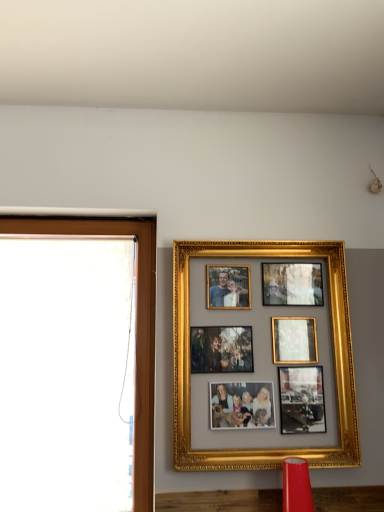
Question: From the image's perspective, is matte red lampshade at lower center on top of brown wooden window frame at left?

Choices:
 (A) yes
 (B) no

Answer: (B)

Question: Does matte red lampshade at lower center have a lesser width compared to brown wooden window frame at left?

Choices:
 (A) yes
 (B) no

Answer: (B)

Question: Is matte red lampshade at lower center facing towards brown wooden window frame at left?

Choices:
 (A) no
 (B) yes

Answer: (A)

Question: Is matte red lampshade at lower center wider than brown wooden window frame at left?

Choices:
 (A) no
 (B) yes

Answer: (B)

Question: Considering the relative sizes of matte red lampshade at lower center and brown wooden window frame at left in the image provided, is matte red lampshade at lower center smaller than brown wooden window frame at left?

Choices:
 (A) yes
 (B) no

Answer: (A)

Question: From the image's perspective, is gold/gilded photo frame at upper center located above or below matte red lampshade at lower center?

Choices:
 (A) above
 (B) below

Answer: (A)

Question: Is gold/gilded photo frame at upper center wider or thinner than matte red lampshade at lower center?

Choices:
 (A) wide
 (B) thin

Answer: (B)

Question: Considering the positions of gold/gilded photo frame at upper center and matte red lampshade at lower center in the image, is gold/gilded photo frame at upper center bigger or smaller than matte red lampshade at lower center?

Choices:
 (A) small
 (B) big

Answer: (B)

Question: Considering their positions, is gold/gilded photo frame at upper center located in front of or behind matte red lampshade at lower center?

Choices:
 (A) behind
 (B) front

Answer: (A)

Question: From the image's perspective, is matte red lampshade at lower center above or below brown wooden window frame at left?

Choices:
 (A) above
 (B) below

Answer: (B)

Question: From a real-world perspective, relative to brown wooden window frame at left, is matte red lampshade at lower center vertically above or below?

Choices:
 (A) above
 (B) below

Answer: (B)

Question: Considering the positions of matte red lampshade at lower center and brown wooden window frame at left in the image, is matte red lampshade at lower center taller or shorter than brown wooden window frame at left?

Choices:
 (A) short
 (B) tall

Answer: (A)

Question: Does point (302, 465) appear closer or farther from the camera than point (39, 217)?

Choices:
 (A) farther
 (B) closer

Answer: (B)

Question: Considering the positions of matte red lampshade at lower center and gold/gilded photo frame at upper center in the image, is matte red lampshade at lower center wider or thinner than gold/gilded photo frame at upper center?

Choices:
 (A) thin
 (B) wide

Answer: (B)

Question: Choose the correct answer: Is matte red lampshade at lower center inside gold/gilded photo frame at upper center or outside it?

Choices:
 (A) outside
 (B) inside

Answer: (A)